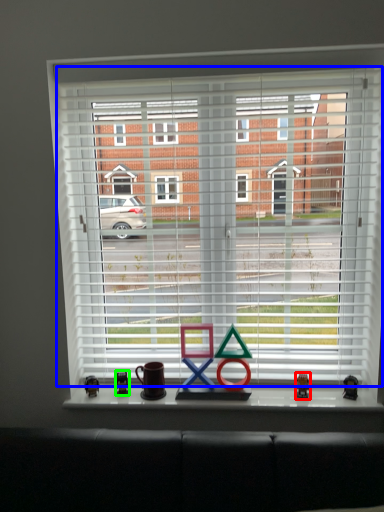
Question: Based on their relative distances, which object is nearer to miniature (highlighted by a red box)? Choose from window blind (highlighted by a blue box) and miniature (highlighted by a green box).

Choices:
 (A) window blind
 (B) miniature

Answer: (B)